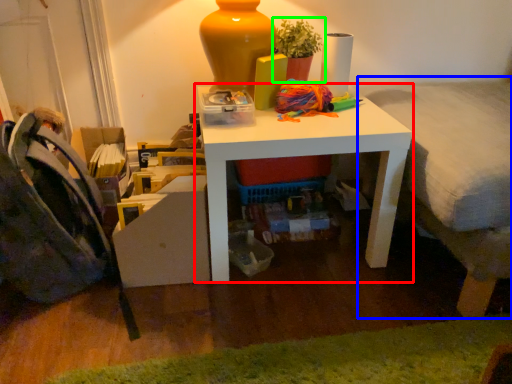
Question: Which object is positioned closest to table (highlighted by a red box)? Select from bed (highlighted by a blue box) and houseplant (highlighted by a green box).

Choices:
 (A) bed
 (B) houseplant

Answer: (A)